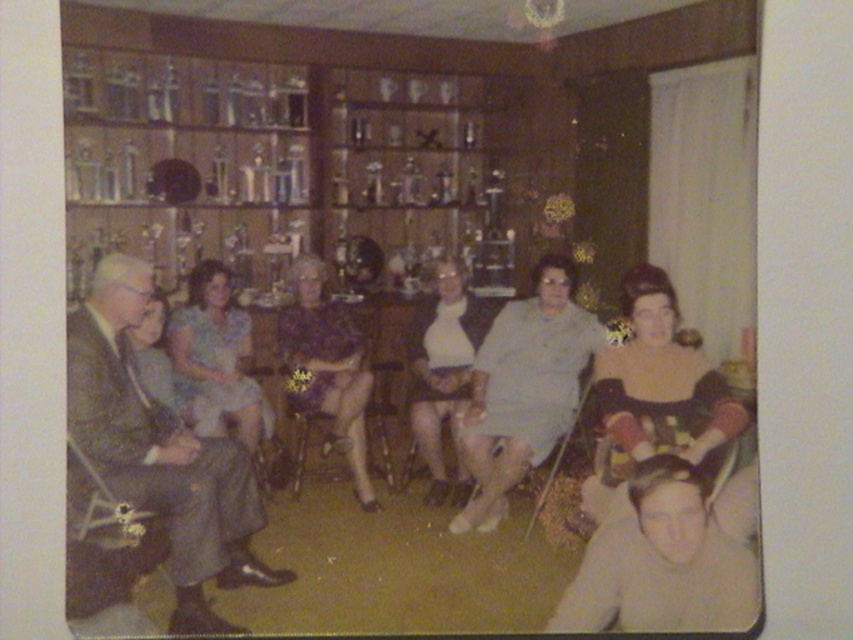
What are the coordinates of the matte gray suit at center?

The coordinates of the matte gray suit at center are 0.770 in the x direction and 0.494 in the y direction.

You are standing in the living room and want to move from the point at coordinates point (608, 349) to the point at coordinates point (235, 417). Can you walk directly between these two points without any obstacles?

Point (608, 349) is in front of point (235, 417), so there might be an obstacle between them. Therefore, you cannot walk directly between these two points without any obstacles.